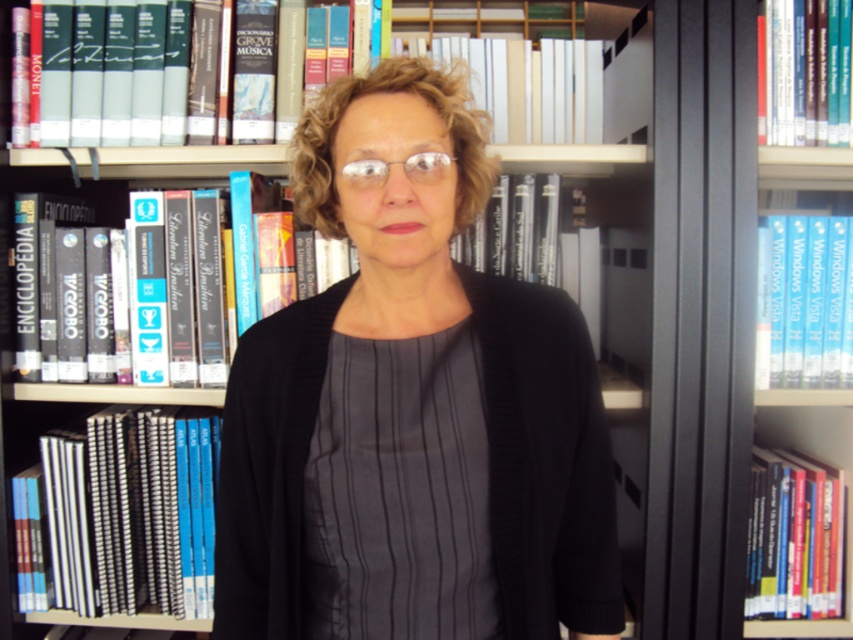
From the picture: You are a photographer trying to capture the black matte sweater at center and the hardcover book at upper left in the same frame. Based on their positions, which object should you adjust your camera to focus on first to ensure both are in the frame?

The black matte sweater at center is to the right of the hardcover book at upper left, so you should focus on the hardcover book at upper left first to ensure both are included in the frame.

You are organizing a library and need to place a new book on the shelf. The new book must be placed exactly at the position of the hardcover book at center. What are the coordinates where you should place the new book?

The coordinates for the hardcover book at center are 0.280 on the x axis and 0.041 on the y axis, so you should place the new book at those coordinates.